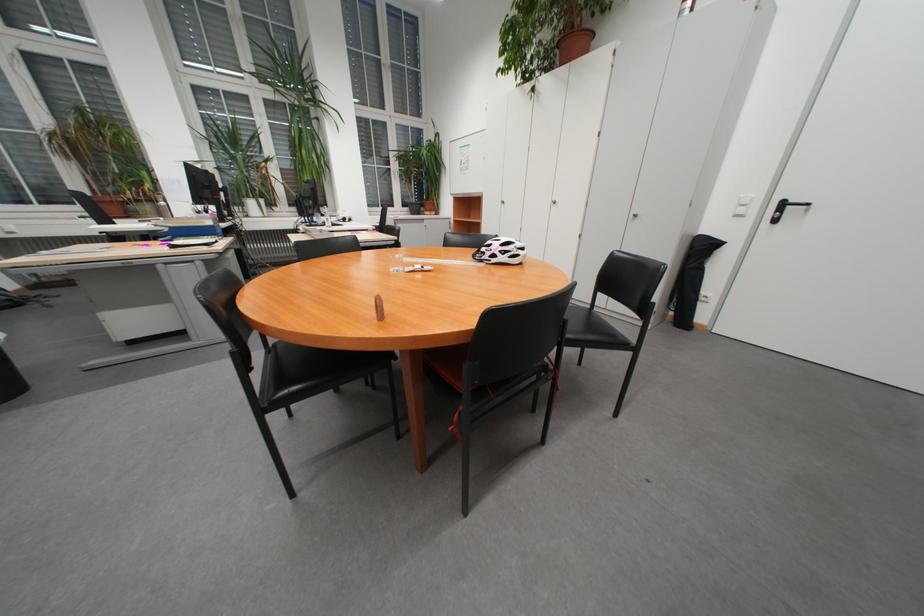
I want to click on small brown cylinder, so point(379,307).